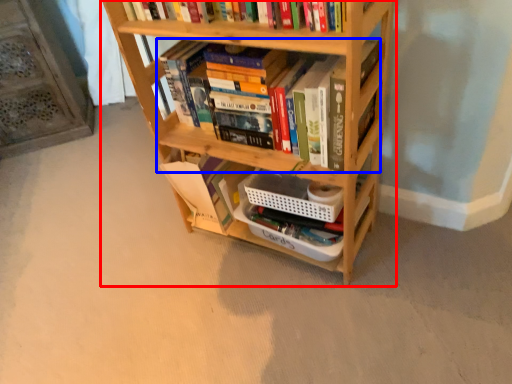
Question: Which of the following is the farthest to the observer, bookcase (highlighted by a red box) or book (highlighted by a blue box)?

Choices:
 (A) bookcase
 (B) book

Answer: (B)